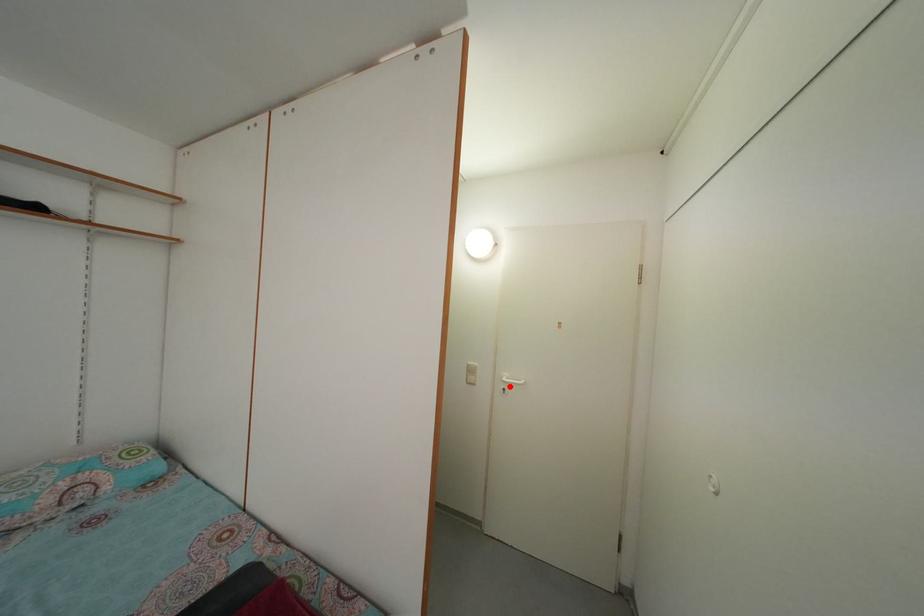
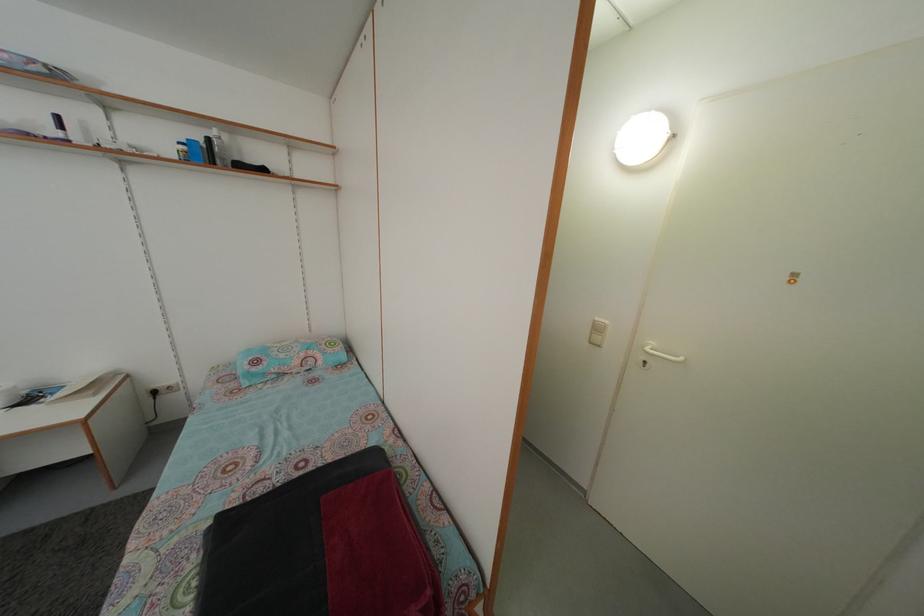
Find the pixel in the second image that matches the highlighted location in the first image.

(652, 355)